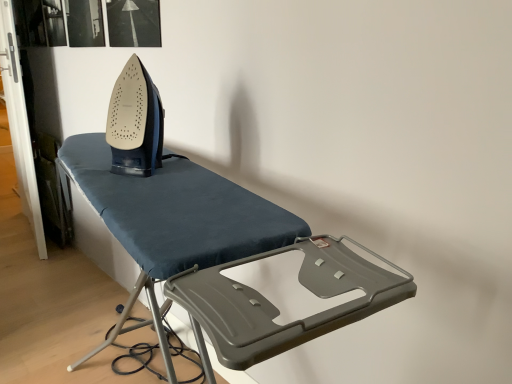
In order to click on free point in front of matte black iron at center in this screenshot , I will do `click(154, 192)`.